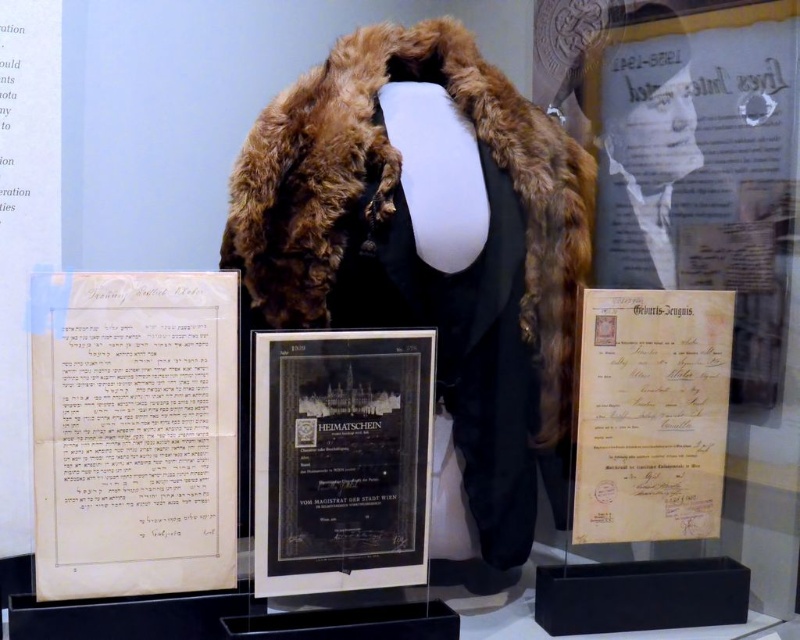
You are a visitor standing in front of the display case. You notice two points marked in the image. Which point is closer to you, point at coordinate (182,449) or point at coordinate (640,380)?

Point at coordinate (182,449) is closer to you because it is in front of point at coordinate (640,380).

You are a museum visitor standing in front of the display case. You notice the brown fur coat at center and the black glass plaque at center. Which object is positioned higher in the display case?

The brown fur coat at center is located above the black glass plaque at center, so it is positioned higher in the display case.